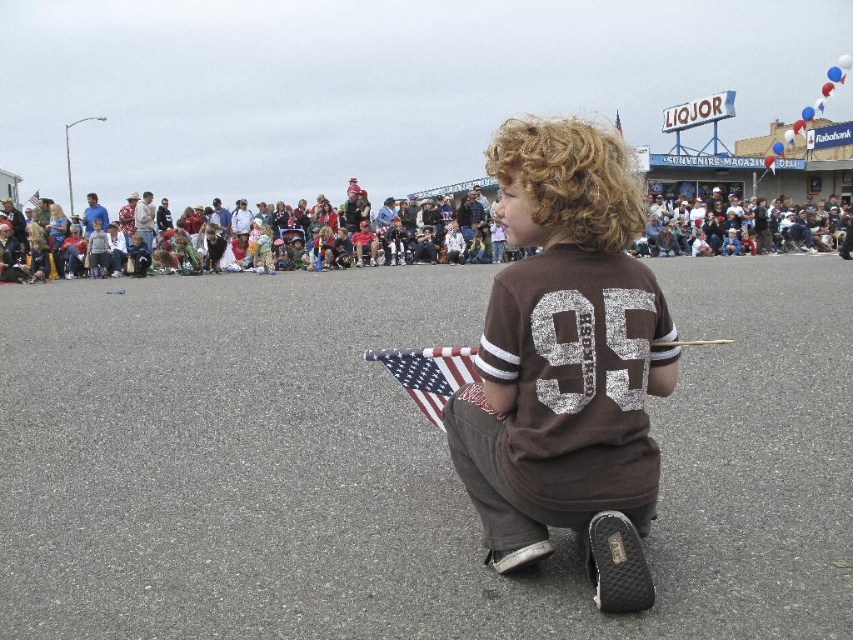
You are a photographer trying to capture the American flag at center without any obstructions. The child wearing the brown jersey at center is currently blocking your view. Can you move the child to the side so the flag is visible? Explain your reasoning.

The brown jersey at center is positioned over the american flag at center, meaning the flag is currently covered by the jersey. Moving the child wearing the jersey would allow the flag to be visible without obstruction.

You are a photographer at the event and want to capture a clear shot of the american flag at center without the multicolored fabric crowd at center blocking it. What should you do?

The multicolored fabric crowd at center is much taller than the american flag at center, so you should lower your camera angle to avoid the crowd blocking the flag.

You are a photographer at the event and want to capture a photo where the brown jersey at center and the american flag at center are both visible. Based on their positions, which object should be placed on the left side of the photo frame?

The american flag at center should be placed on the left side of the photo frame because the brown jersey at center is to the right of it.